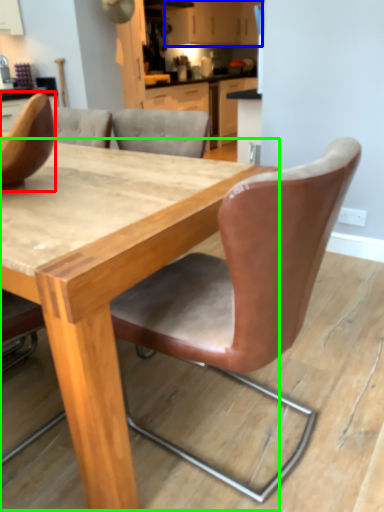
Question: Based on their relative distances, which object is nearer to chair (highlighted by a red box)? Choose from cabinetry (highlighted by a blue box) and table (highlighted by a green box).

Choices:
 (A) cabinetry
 (B) table

Answer: (B)